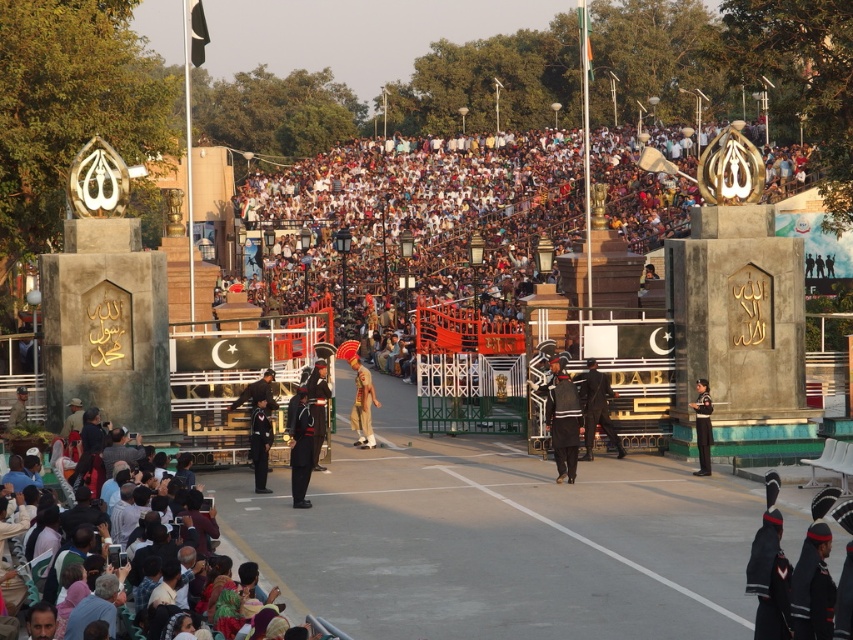
Is point (366, 381) positioned after point (706, 429)?

That is True.

Is khaki uniform at center shorter than dark blue uniform at center?

Incorrect, khaki uniform at center's height does not fall short of dark blue uniform at center's.

Where is `khaki uniform at center`? The image size is (853, 640). khaki uniform at center is located at coordinates (363, 404).

Is dark brown fabric crowd at center to the left of khaki uniform at center from the viewer's perspective?

Correct, you'll find dark brown fabric crowd at center to the left of khaki uniform at center.

Which is behind, point (260, 557) or point (360, 417)?

The point (360, 417) is behind.

Where is `dark brown fabric crowd at center`? dark brown fabric crowd at center is located at coordinates (259, 570).

Is dark brown crowd at center wider than khaki uniform at center?

Yes, dark brown crowd at center is wider than khaki uniform at center.

Who is taller, dark brown crowd at center or khaki uniform at center?

dark brown crowd at center

Is point (490, 300) positioned before point (363, 385)?

No, it is not.

What are the coordinates of `dark brown crowd at center` in the screenshot? It's located at (412, 228).